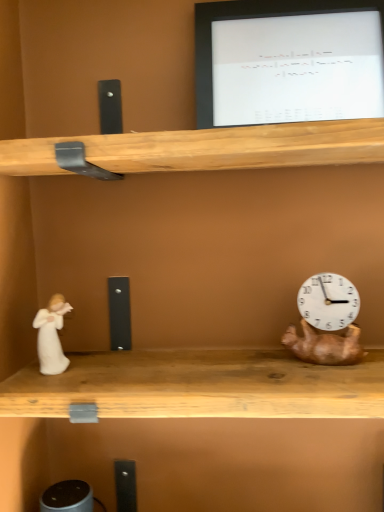
Question: Considering the relative positions of white glossy monitor at upper center and copper metallic clock at right in the image provided, is white glossy monitor at upper center to the left or to the right of copper metallic clock at right?

Choices:
 (A) right
 (B) left

Answer: (B)

Question: From their relative heights in the image, would you say white glossy monitor at upper center is taller or shorter than copper metallic clock at right?

Choices:
 (A) tall
 (B) short

Answer: (A)

Question: Which object is positioned closest to the white glossy monitor at upper center?

Choices:
 (A) white porcelain figurine at left
 (B) copper metallic clock at right

Answer: (B)

Question: Which of these objects is positioned closest to the white porcelain figurine at left?

Choices:
 (A) copper metallic clock at right
 (B) white glossy monitor at upper center

Answer: (A)